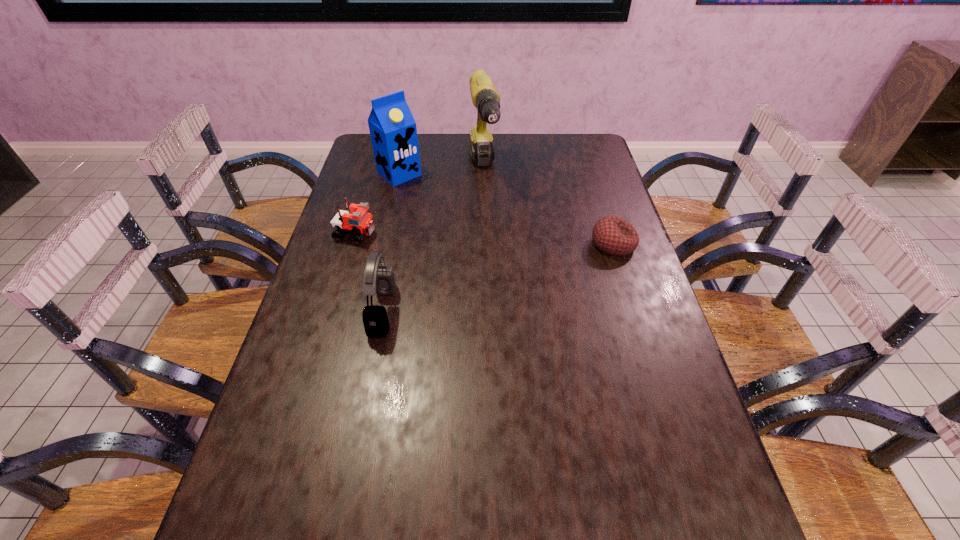
Locate an element on the screen. This screenshot has width=960, height=540. the third shortest object is located at coordinates (380, 280).

Where is `headset`? This screenshot has width=960, height=540. headset is located at coordinates (380, 280).

Locate an element on the screen. The width and height of the screenshot is (960, 540). beanbag is located at coordinates (612, 235).

This screenshot has height=540, width=960. I want to click on the shortest object, so [x=612, y=235].

The width and height of the screenshot is (960, 540). I want to click on Lego, so click(356, 220).

Locate an element on the screen. the fourth object from left to right is located at coordinates (485, 97).

Locate an element on the screen. This screenshot has height=540, width=960. carton is located at coordinates (393, 131).

Where is `free space located on the headband of the third shortest object`? The image size is (960, 540). free space located on the headband of the third shortest object is located at coordinates (348, 311).

The image size is (960, 540). Find the location of `vacant space located 0.360m on the front of the beanbag`. vacant space located 0.360m on the front of the beanbag is located at coordinates (653, 369).

Identify the location of vacant space situated 0.070m on the front-facing side of the Lego. Image resolution: width=960 pixels, height=540 pixels. (396, 241).